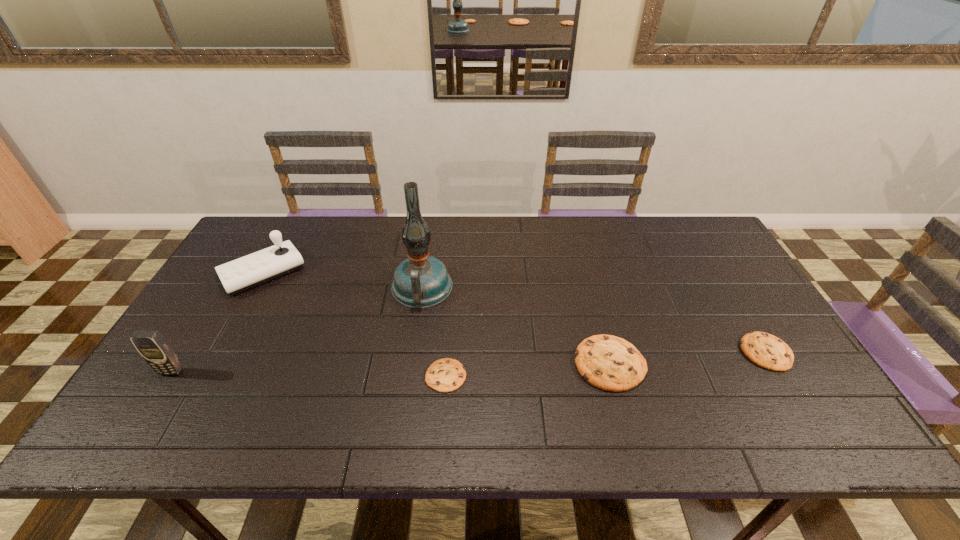
Find the location of a particular element. the shortest cookie is located at coordinates (445, 375).

In order to click on the leftmost cookie in this screenshot , I will do `click(445, 375)`.

Locate an element on the screen. The width and height of the screenshot is (960, 540). the second object from right to left is located at coordinates (610, 363).

The image size is (960, 540). Find the location of `the second cookie from right to left`. the second cookie from right to left is located at coordinates pyautogui.click(x=610, y=363).

Identify the location of the rightmost object. The height and width of the screenshot is (540, 960). (766, 350).

What are the coordinates of `the rightmost cookie` in the screenshot? It's located at (766, 350).

Locate an element on the screen. This screenshot has height=540, width=960. oil lamp is located at coordinates (421, 281).

You are a GUI agent. You are given a task and a screenshot of the screen. Output one action in this format:
    pyautogui.click(x=<x>, y=<y>)
    Task: Click on the fifth shortest object
    
    Given the screenshot: What is the action you would take?
    pos(157,352)

Locate an element on the screen. This screenshot has width=960, height=540. the fourth shortest object is located at coordinates (246, 272).

Where is `vacant space located on the back of the shortest cookie`? Image resolution: width=960 pixels, height=540 pixels. vacant space located on the back of the shortest cookie is located at coordinates (453, 275).